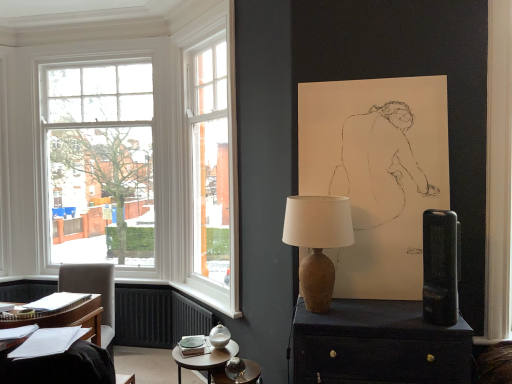
I want to click on brown ceramic lamp at center, so click(317, 243).

Where is `matte brown cabinet at center`? This screenshot has height=384, width=512. matte brown cabinet at center is located at coordinates (378, 345).

What do you see at coordinates (378, 345) in the screenshot? The image size is (512, 384). I see `matte brown cabinet at center` at bounding box center [378, 345].

I want to click on white paper at lower left, so click(64, 354).

Where is `brown ceramic lamp at center`? Image resolution: width=512 pixels, height=384 pixels. brown ceramic lamp at center is located at coordinates (317, 243).

Considering the sizes of objects matte brown side table at lower center and matte brown cabinet at center in the image provided, who is taller, matte brown side table at lower center or matte brown cabinet at center?

matte brown cabinet at center is taller.

Which object is closer to the camera taking this photo, matte brown side table at lower center or matte brown cabinet at center?

matte brown cabinet at center is more forward.

From a real-world perspective, is matte brown side table at lower center physically located above or below matte brown cabinet at center?

Clearly, from a real-world perspective, matte brown side table at lower center is below matte brown cabinet at center.

Between matte brown side table at lower center and matte brown cabinet at center, which one has larger width?

Wider between the two is matte brown cabinet at center.

Considering the relative sizes of white glass window at left and white paper at lower left in the image provided, is white glass window at left smaller than white paper at lower left?

No.

Does white glass window at left turn towards white paper at lower left?

Yes, white glass window at left faces towards white paper at lower left.

From a real-world perspective, who is located higher, white glass window at left or white paper at lower left?

white glass window at left is physically above.

Is white glass window at left wider or thinner than white paper at lower left?

In the image, white glass window at left appears to be more narrow than white paper at lower left.

Considering the sizes of objects black plastic speaker at right and white paper at lower left in the image provided, who is thinner, black plastic speaker at right or white paper at lower left?

black plastic speaker at right is thinner.

Who is smaller, black plastic speaker at right or white paper at lower left?

With smaller size is white paper at lower left.

From the picture: Is black plastic speaker at right to the right of white glass window at left from the viewer's perspective?

→ Indeed, black plastic speaker at right is positioned on the right side of white glass window at left.

How distant is black plastic speaker at right from white glass window at left?

The distance of black plastic speaker at right from white glass window at left is 9.11 feet.

Would you say black plastic speaker at right is inside or outside white glass window at left?

black plastic speaker at right is located beyond the bounds of white glass window at left.

You are a GUI agent. You are given a task and a screenshot of the screen. Output one action in this format:
    pyautogui.click(x=<x>, y=<y>)
    Task: Click on the loudspeaker lying in front of the white glass window at left
    Image resolution: width=512 pixels, height=384 pixels.
    Given the screenshot: What is the action you would take?
    pyautogui.click(x=440, y=267)

Can you confirm if matte brown cabinet at center is bigger than white glass window at left?

Actually, matte brown cabinet at center might be smaller than white glass window at left.

Can you tell me how much matte brown cabinet at center and white glass window at left differ in facing direction?

0.155 degrees.

This screenshot has height=384, width=512. I want to click on cabinetry that appears below the white glass window at left (from the image's perspective), so 378,345.

Is the surface of matte brown cabinet at center in direct contact with white glass window at left?

There is a gap between matte brown cabinet at center and white glass window at left.

Is black plastic speaker at right far from matte brown cabinet at center?

No.

Considering the relative sizes of black plastic speaker at right and matte brown cabinet at center in the image provided, is black plastic speaker at right bigger than matte brown cabinet at center?

No.

Is the depth of black plastic speaker at right less than that of matte brown cabinet at center?

Yes, it is.

From the image's perspective, is black plastic speaker at right under matte brown cabinet at center?

No, from the image's perspective, black plastic speaker at right is not below matte brown cabinet at center.

Does point (324, 277) appear closer or farther from the camera than point (68, 380)?

Point (324, 277) is positioned farther from the camera compared to point (68, 380).

Based on the photo, who is bigger, brown ceramic lamp at center or white paper at lower left?

Bigger between the two is brown ceramic lamp at center.

Is brown ceramic lamp at center inside the boundaries of white paper at lower left, or outside?

brown ceramic lamp at center cannot be found inside white paper at lower left.

Where is `cabinetry in front of the matte brown side table at lower center`? The height and width of the screenshot is (384, 512). cabinetry in front of the matte brown side table at lower center is located at coordinates (378, 345).

Find the location of a particular element. The width and height of the screenshot is (512, 384). window that is on the left side of white paper at lower left is located at coordinates (108, 156).

Based on their spatial positions, is white paper at lower left or black plastic speaker at right closer to brown ceramic lamp at center?

The object closer to brown ceramic lamp at center is black plastic speaker at right.

From the image, which object appears to be farther from matte brown side table at lower center, light gray fabric chair at left or white paper at lower left?

light gray fabric chair at left lies further to matte brown side table at lower center than the other object.

Looking at the image, which one is located further to white paper at lower left, white glass window at left or brown ceramic lamp at center?

white glass window at left is further to white paper at lower left.

When comparing their distances from white glass window at left, does light gray fabric chair at left or black plastic speaker at right seem closer?

The object closer to white glass window at left is light gray fabric chair at left.

Estimate the real-world distances between objects in this image. Which object is closer to matte brown side table at lower center, brown ceramic lamp at center or black plastic speaker at right?

brown ceramic lamp at center.

When comparing their distances from matte brown side table at lower center, does matte brown cabinet at center or brown ceramic lamp at center seem closer?

The object closer to matte brown side table at lower center is matte brown cabinet at center.

Estimate the real-world distances between objects in this image. Which object is closer to light gray fabric chair at left, white paper at lower left or white glass window at left?

Among the two, white glass window at left is located nearer to light gray fabric chair at left.

Based on the photo, from the image, which object appears to be farther from brown ceramic lamp at center, matte brown cabinet at center or light gray fabric chair at left?

Based on the image, light gray fabric chair at left appears to be further to brown ceramic lamp at center.

I want to click on chair between white glass window at left and matte brown cabinet at center, so (x=93, y=292).

Identify the location of table between light gray fabric chair at left and black plastic speaker at right from left to right. (205, 359).

This screenshot has width=512, height=384. What are the coordinates of `cabinetry between matte brown side table at lower center and black plastic speaker at right` in the screenshot? It's located at (378, 345).

Find the location of `loudspeaker between brown ceramic lamp at center and matte brown cabinet at center in the vertical direction`. loudspeaker between brown ceramic lamp at center and matte brown cabinet at center in the vertical direction is located at coordinates (440, 267).